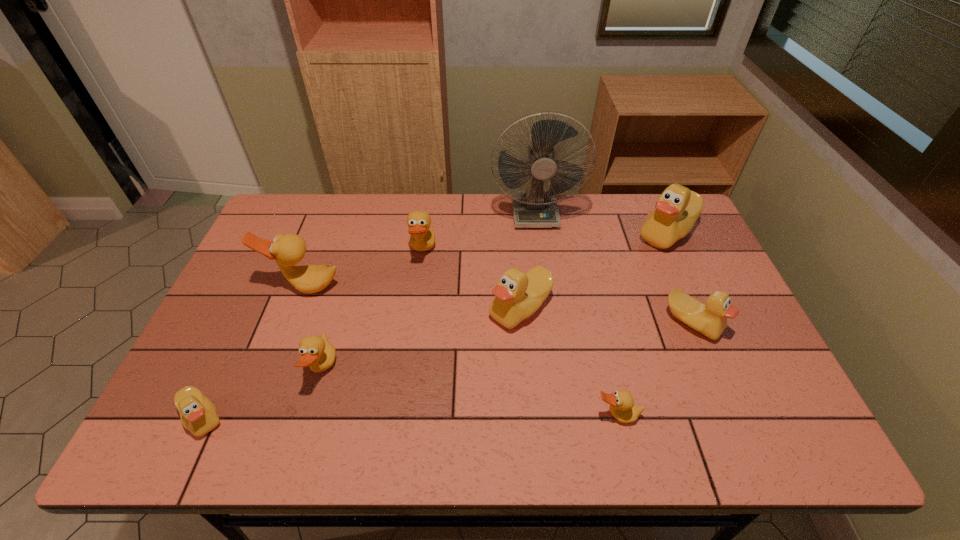
Find the location of `vacant area at the left edge of the desktop`. vacant area at the left edge of the desktop is located at coordinates (226, 372).

Identify the location of vacant space at the near left corner. The width and height of the screenshot is (960, 540). (179, 452).

Locate an element on the screen. This screenshot has width=960, height=540. vacant region between the gray fan and the fifth duck from left to right is located at coordinates (528, 261).

The width and height of the screenshot is (960, 540). I want to click on vacant area between the smallest beige duck and the second farthest tan duck, so click(253, 352).

The height and width of the screenshot is (540, 960). What are the coordinates of `free space between the third biggest tan duck and the second biggest tan duck` in the screenshot? It's located at (372, 311).

Where is `free area in between the second beige duck from left to right and the nearest tan duck`? Image resolution: width=960 pixels, height=540 pixels. free area in between the second beige duck from left to right and the nearest tan duck is located at coordinates (568, 362).

The height and width of the screenshot is (540, 960). What are the coordinates of `vacant space that's between the third beige duck from right to left and the biggest beige duck` in the screenshot? It's located at (593, 271).

Locate an element on the screen. This screenshot has height=540, width=960. unoccupied position between the third biggest tan duck and the second beige duck from left to right is located at coordinates (421, 339).

Locate an element on the screen. This screenshot has height=540, width=960. free space between the third biggest beige duck and the biggest beige duck is located at coordinates (680, 278).

This screenshot has height=540, width=960. Find the location of `blank region between the biggest beige duck and the tallest object`. blank region between the biggest beige duck and the tallest object is located at coordinates (601, 223).